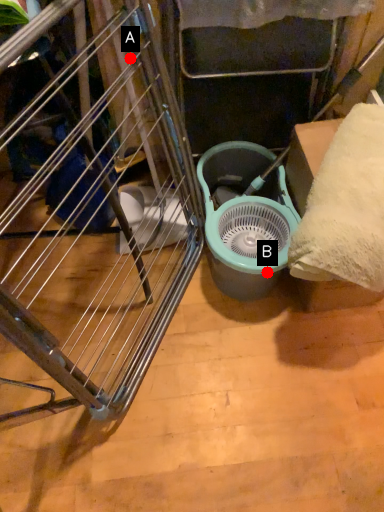
Question: Two points are circled on the image, labeled by A and B beside each circle. Which point is further to the camera?

Choices:
 (A) A is further
 (B) B is further

Answer: (B)